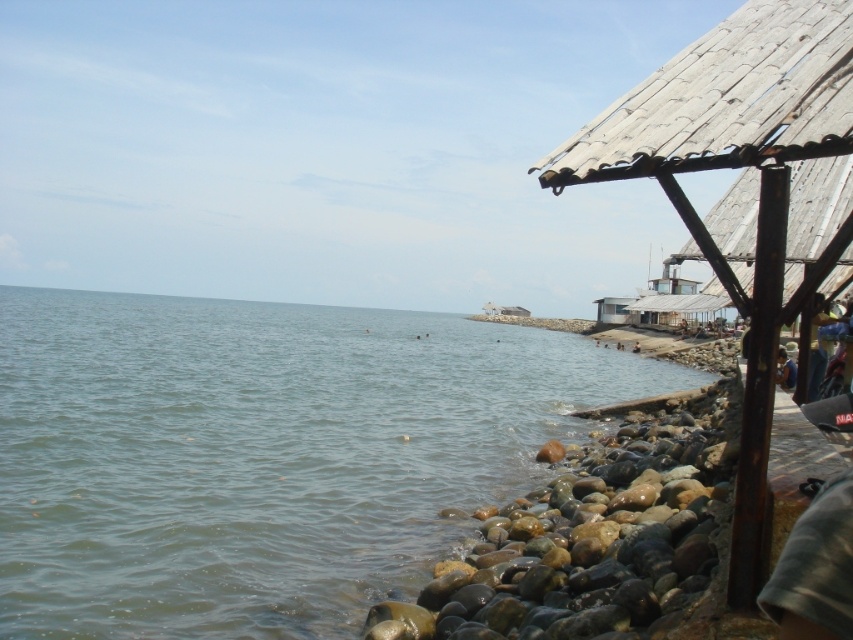
You are a photographer setting up equipment on the rocky shoreline. You have the rusty metallic rocks at lower right and the dark blue fabric at lower right in your frame. Which object appears taller in the photo?

The rusty metallic rocks at lower right appears taller than the dark blue fabric at lower right in the photo.

You are standing on the rocky shoreline and want to walk to the rusty metal roof at right. Which direction should you head towards to avoid the clear water at lower left?

To avoid the clear water at lower left, you should head towards the right side of the rusty metal roof at right since the clear water at lower left is positioned on the left side of it.